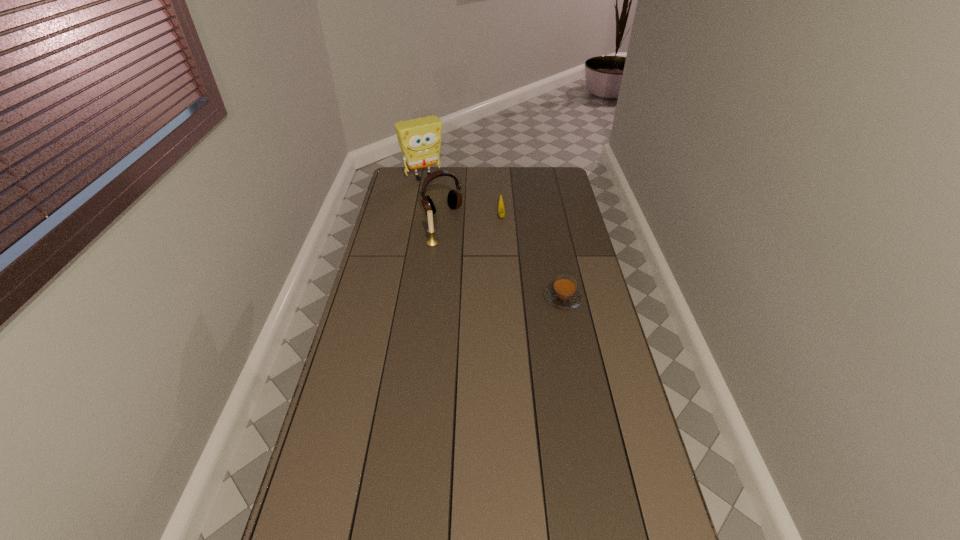
Image resolution: width=960 pixels, height=540 pixels. Identify the location of free space between the nearest object and the banana. (532, 256).

Locate an element on the screen. This screenshot has height=540, width=960. free space between the headset and the banana is located at coordinates (471, 213).

At what (x,y) coordinates should I click in order to perform the action: click on unoccupied area between the fourth shortest object and the sponge. Please return your answer as a coordinate pair (x, y). The height and width of the screenshot is (540, 960). Looking at the image, I should click on (433, 194).

Find the location of `vacant region between the second tallest object and the banana`. vacant region between the second tallest object and the banana is located at coordinates (471, 213).

At what (x,y) coordinates should I click in order to perform the action: click on free area in between the headset and the rightmost object. Please return your answer as a coordinate pair (x, y). Looking at the image, I should click on (503, 255).

The width and height of the screenshot is (960, 540). Find the location of `free area in between the farthest object and the nearest object`. free area in between the farthest object and the nearest object is located at coordinates pyautogui.click(x=493, y=238).

Where is `vacant area that lies between the banana and the sponge`? Image resolution: width=960 pixels, height=540 pixels. vacant area that lies between the banana and the sponge is located at coordinates (463, 195).

Find the location of a particular element. unoccupied area between the tallest object and the cappuccino is located at coordinates (493, 238).

You are a GUI agent. You are given a task and a screenshot of the screen. Output one action in this format:
    pyautogui.click(x=<x>, y=<y>)
    Task: Click on the object that is the second closest to the tallest object
    The height and width of the screenshot is (540, 960).
    Given the screenshot: What is the action you would take?
    pyautogui.click(x=501, y=210)

Where is `object that stands as the third closest to the headset`? object that stands as the third closest to the headset is located at coordinates (501, 210).